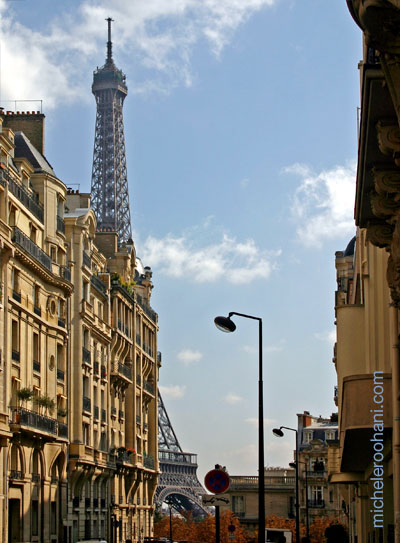
Find the location of `white framed windows`. white framed windows is located at coordinates (310, 435), (328, 435).